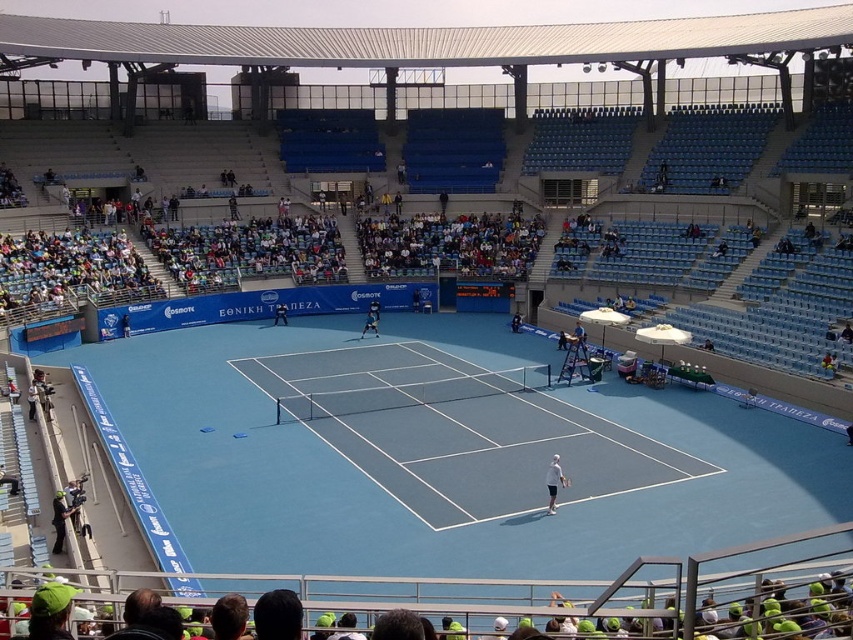
Is blue synthetic surface at center bigger than dark blue uniform at center?

Yes.

Between blue synthetic surface at center and dark blue uniform at center, which one is positioned lower?

blue synthetic surface at center is lower down.

Between point (485, 504) and point (511, 320), which one is positioned behind?

The point (511, 320) is more distant.

Where is `blue synthetic surface at center`? Image resolution: width=853 pixels, height=640 pixels. blue synthetic surface at center is located at coordinates (457, 429).

Does white fabric umbrella at center appear under white tennis racket at center?

Indeed, white fabric umbrella at center is positioned under white tennis racket at center.

Can you confirm if white fabric umbrella at center is shorter than white tennis racket at center?

No, white fabric umbrella at center is not shorter than white tennis racket at center.

I want to click on white fabric umbrella at center, so click(x=410, y=595).

Who is lower down, blue synthetic surface at center or white tennis racket at center?

blue synthetic surface at center is below.

Between blue synthetic surface at center and white tennis racket at center, which one is positioned higher?

white tennis racket at center is above.

Does point (656, 464) come farther from viewer compared to point (376, 333)?

No, (656, 464) is in front of (376, 333).

Locate an element on the screen. The height and width of the screenshot is (640, 853). blue synthetic surface at center is located at coordinates (457, 429).